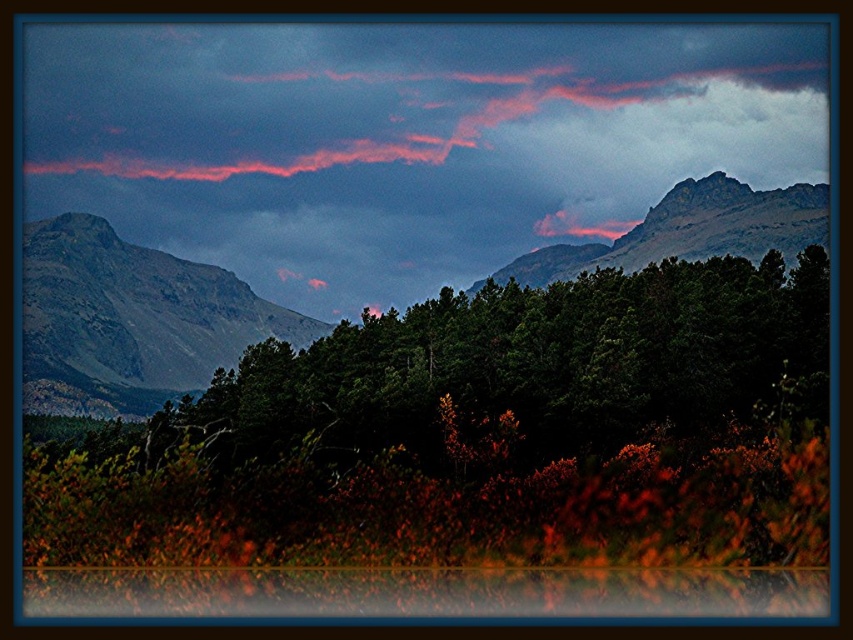
Question: Which of the following is the farthest from the observer?

Choices:
 (A) green textured forest at center
 (B) rugged stone mountain at left
 (C) pink matte cloud at upper center
 (D) green matte tree at center

Answer: (C)

Question: Estimate the real-world distances between objects in this image. Which object is farther from the pink matte cloud at upper center?

Choices:
 (A) green textured forest at center
 (B) rugged stone mountain at left
 (C) green matte tree at center

Answer: (C)

Question: Can you confirm if pink matte cloud at upper center is bigger than green matte tree at center?

Choices:
 (A) no
 (B) yes

Answer: (B)

Question: Which point is farther to the camera?

Choices:
 (A) green matte tree at center
 (B) rugged stone mountain at left
 (C) green textured forest at center

Answer: (B)

Question: Can you confirm if green textured forest at center is positioned to the right of rugged stone mountain at left?

Choices:
 (A) no
 (B) yes

Answer: (B)

Question: Is pink matte cloud at upper center above rugged stone mountain at left?

Choices:
 (A) no
 (B) yes

Answer: (B)